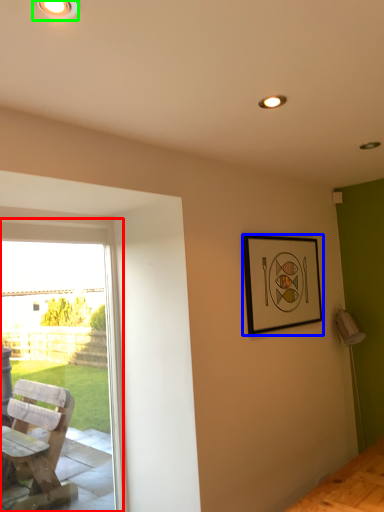
Question: Which object is the closest to the window (highlighted by a red box)? Choose among these: picture frame (highlighted by a blue box) or light fixture (highlighted by a green box).

Choices:
 (A) picture frame
 (B) light fixture

Answer: (A)